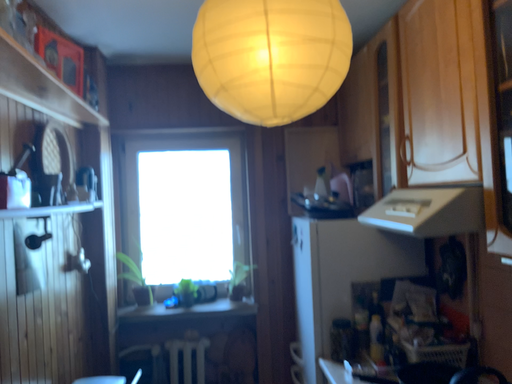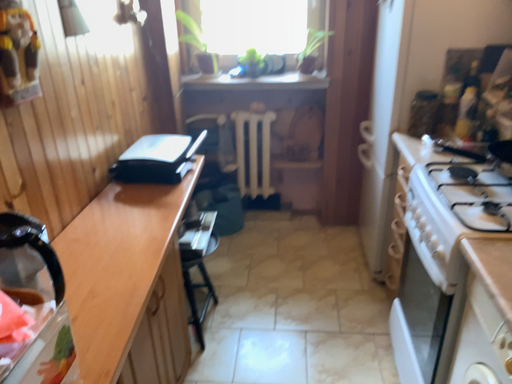
Question: How did the camera likely rotate when shooting the video?

Choices:
 (A) rotated left
 (B) rotated right

Answer: (A)